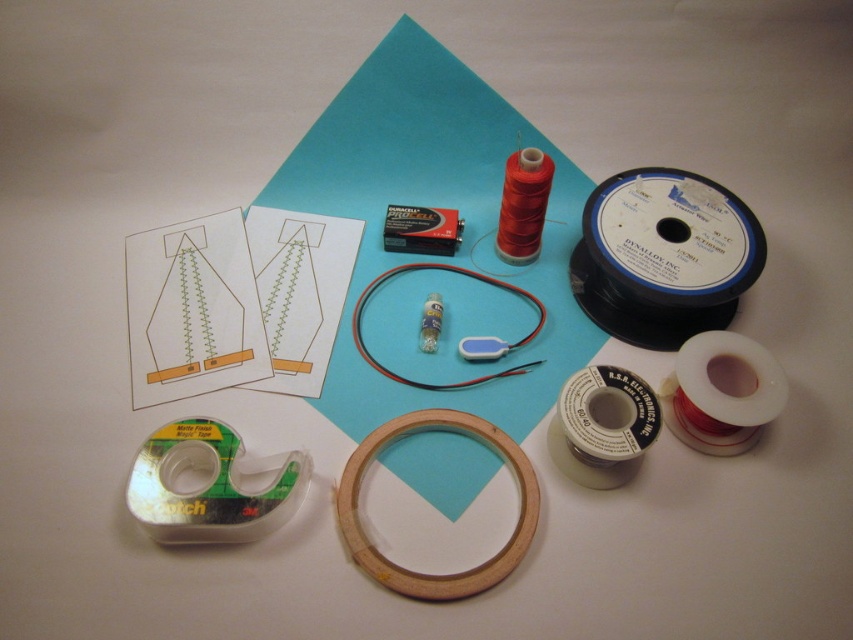
Identify the location of black matte spool at upper right. The width and height of the screenshot is (853, 640). pos(663,257).

Who is taller, black matte spool at upper right or wooden ring at center?

black matte spool at upper right is taller.

From the picture: Who is more forward, (631, 292) or (514, 451)?

Point (514, 451) is in front.

I want to click on black matte spool at upper right, so click(663, 257).

Can you confirm if wooden ring at center is thinner than white matte tape at center right?

No, wooden ring at center is not thinner than white matte tape at center right.

Does wooden ring at center have a smaller size compared to white matte tape at center right?

No.

Which is behind, point (515, 476) or point (720, 445)?

Positioned behind is point (720, 445).

Identify the location of wooden ring at center. (431, 573).

Does point (553, 458) come closer to viewer compared to point (479, 278)?

Yes, point (553, 458) is closer to viewer.

Who is more distant from viewer, (x=566, y=403) or (x=534, y=336)?

The point (x=534, y=336) is more distant.

Is point (622, 465) in front of point (373, 288)?

Yes, point (622, 465) is in front of point (373, 288).

Where is `silver matte tape at center-right`? silver matte tape at center-right is located at coordinates (604, 424).